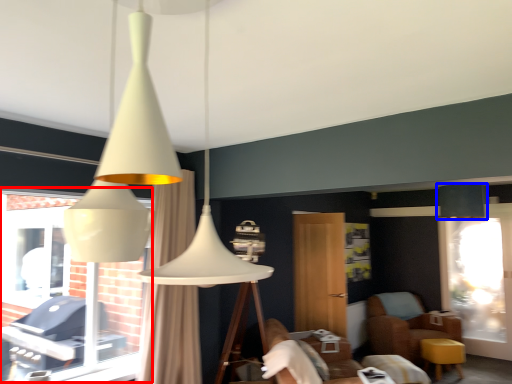
Question: Among these objects, which one is farthest to the camera, bay window (highlighted by a red box) or lamp (highlighted by a blue box)?

Choices:
 (A) bay window
 (B) lamp

Answer: (B)